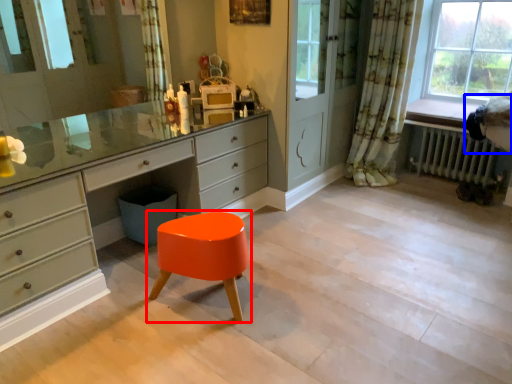
Question: Which object appears closest to the camera in this image, stool (highlighted by a red box) or swivel chair (highlighted by a blue box)?

Choices:
 (A) stool
 (B) swivel chair

Answer: (A)